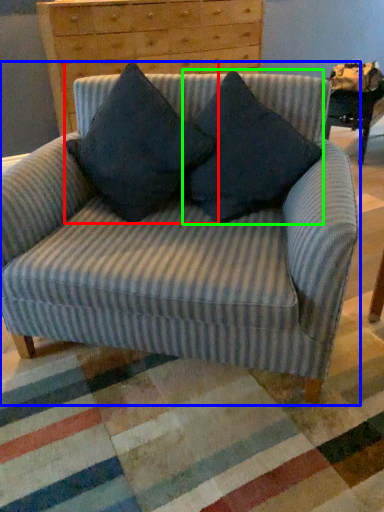
Question: Based on their relative distances, which object is nearer to pillow (highlighted by a red box)? Choose from chair (highlighted by a blue box) and pillow (highlighted by a green box).

Choices:
 (A) chair
 (B) pillow

Answer: (B)